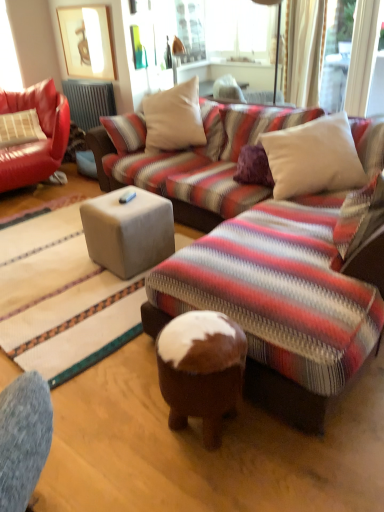
Question: Looking at their shapes, would you say white soft cushion at upper right, the 2th pillow from the back, is wider or thinner than suede-like beige cube at center?

Choices:
 (A) thin
 (B) wide

Answer: (B)

Question: Do you think white soft cushion at upper right, the first pillow ordered from the bottom, is within suede-like beige cube at center, or outside of it?

Choices:
 (A) outside
 (B) inside

Answer: (A)

Question: Estimate the real-world distances between objects in this image. Which object is farther from the metallic gray radiator at upper left?

Choices:
 (A) brown suede stool at center
 (B) leather pillow at left, the first pillow viewed from the top
 (C) suede-like beige cube at center
 (D) leather couch at left
 (E) white soft cushion at upper right, acting as the 1th pillow starting from the front

Answer: (A)

Question: Estimate the real-world distances between objects in this image. Which object is closer to the metallic gray radiator at upper left?

Choices:
 (A) matte wooden picture frame at upper left
 (B) leather couch at left
 (C) suede-like beige cube at center
 (D) white soft cushion at upper right, the 1th pillow when ordered from right to left
 (E) brown suede stool at center

Answer: (B)